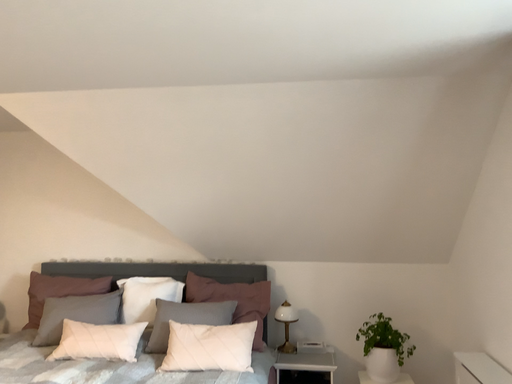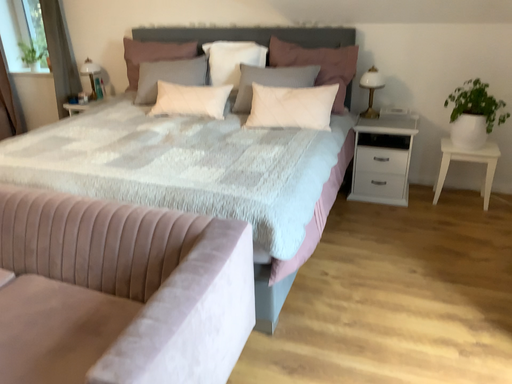
Question: How did the camera likely rotate when shooting the video?

Choices:
 (A) rotated left
 (B) rotated right

Answer: (A)